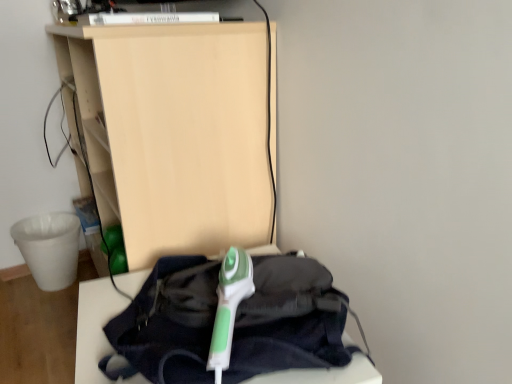
Question: Can you confirm if green plastic iron at center, positioned as the 1th furniture in bottom-to-top order, is positioned to the right of green plastic iron at center?

Choices:
 (A) yes
 (B) no

Answer: (B)

Question: From the image's perspective, would you say green plastic iron at center, which is the 2th furniture from top to bottom, is positioned over green plastic iron at center?

Choices:
 (A) yes
 (B) no

Answer: (B)

Question: Does green plastic iron at center, positioned as the 1th furniture in bottom-to-top order, lie behind green plastic iron at center?

Choices:
 (A) no
 (B) yes

Answer: (A)

Question: Considering the relative sizes of green plastic iron at center, positioned as the 1th furniture in bottom-to-top order, and green plastic iron at center in the image provided, is green plastic iron at center, positioned as the 1th furniture in bottom-to-top order, smaller than green plastic iron at center?

Choices:
 (A) no
 (B) yes

Answer: (A)

Question: Is green plastic iron at center a part of green plastic iron at center, which is the 2th furniture from top to bottom?

Choices:
 (A) yes
 (B) no

Answer: (B)

Question: Does green plastic iron at center, which is the 2th furniture from top to bottom, have a larger size compared to green plastic iron at center?

Choices:
 (A) yes
 (B) no

Answer: (A)

Question: Can you confirm if green plastic iron at center, positioned as the 1th furniture in bottom-to-top order, is shorter than matte wood shelf at upper center, the 2th furniture in the bottom-to-top sequence?

Choices:
 (A) no
 (B) yes

Answer: (B)

Question: Is green plastic iron at center, positioned as the 1th furniture in bottom-to-top order, positioned before matte wood shelf at upper center, which is counted as the first furniture, starting from the top?

Choices:
 (A) no
 (B) yes

Answer: (B)

Question: Is green plastic iron at center, which is the 2th furniture from top to bottom, positioned beyond the bounds of matte wood shelf at upper center, the 2th furniture in the bottom-to-top sequence?

Choices:
 (A) no
 (B) yes

Answer: (B)

Question: Are green plastic iron at center, positioned as the 1th furniture in bottom-to-top order, and matte wood shelf at upper center, which is counted as the first furniture, starting from the top, far apart?

Choices:
 (A) no
 (B) yes

Answer: (A)

Question: Is green plastic iron at center, positioned as the 1th furniture in bottom-to-top order, at the right side of matte wood shelf at upper center, which is counted as the first furniture, starting from the top?

Choices:
 (A) no
 (B) yes

Answer: (B)

Question: From the image's perspective, is green plastic iron at center, which is the 2th furniture from top to bottom, above matte wood shelf at upper center, the 2th furniture in the bottom-to-top sequence?

Choices:
 (A) yes
 (B) no

Answer: (B)

Question: Does green plastic iron at center have a smaller size compared to green plastic iron at center, which is the 2th furniture from top to bottom?

Choices:
 (A) yes
 (B) no

Answer: (A)